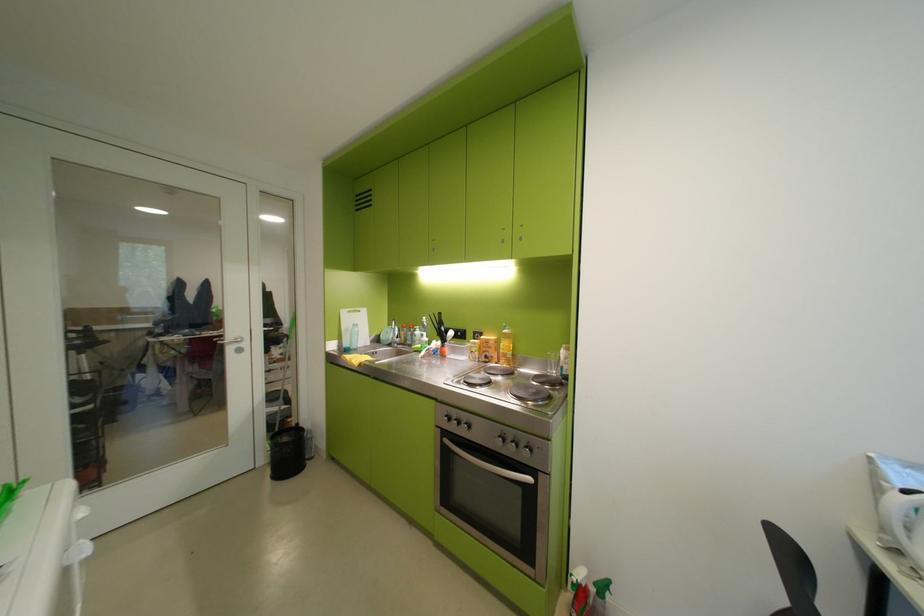
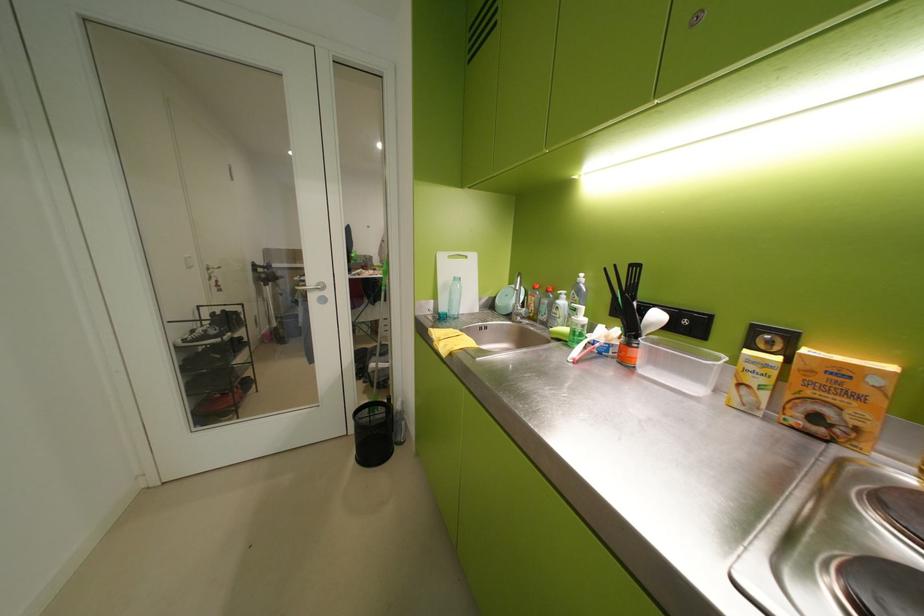
The point at (462, 334) is marked in the first image. Where is the corresponding point in the second image?

(667, 317)